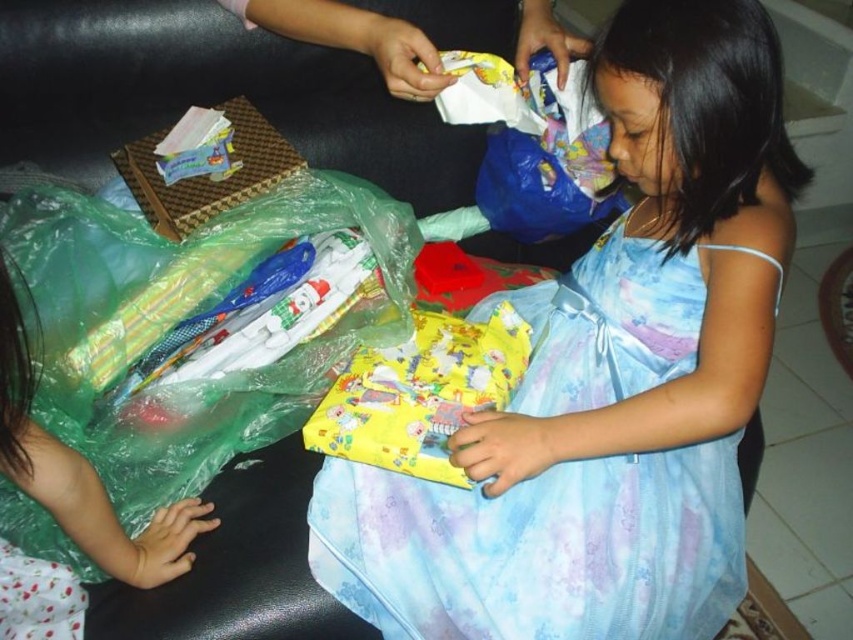
Is point (479, 547) farther from camera compared to point (379, 397)?

That is False.

You are a GUI agent. You are given a task and a screenshot of the screen. Output one action in this format:
    pyautogui.click(x=<x>, y=<y>)
    Task: Click on the light blue satin dress at center
    This screenshot has width=853, height=640.
    Given the screenshot: What is the action you would take?
    coord(577,465)

The width and height of the screenshot is (853, 640). I want to click on light blue satin dress at center, so click(577, 465).

Can you confirm if light blue satin dress at center is positioned to the left of translucent green plastic bag at lower left?

In fact, light blue satin dress at center is to the right of translucent green plastic bag at lower left.

This screenshot has height=640, width=853. Describe the element at coordinates (577, 465) in the screenshot. I see `light blue satin dress at center` at that location.

Describe the element at coordinates (577, 465) in the screenshot. I see `light blue satin dress at center` at that location.

Where is `light blue satin dress at center`? Image resolution: width=853 pixels, height=640 pixels. light blue satin dress at center is located at coordinates (577, 465).

Does light blue satin dress at center have a greater height compared to matte plastic package at upper left?

Yes.

Does point (352, 516) come farther from viewer compared to point (223, 196)?

No.

Where is `light blue satin dress at center`? The image size is (853, 640). light blue satin dress at center is located at coordinates (577, 465).